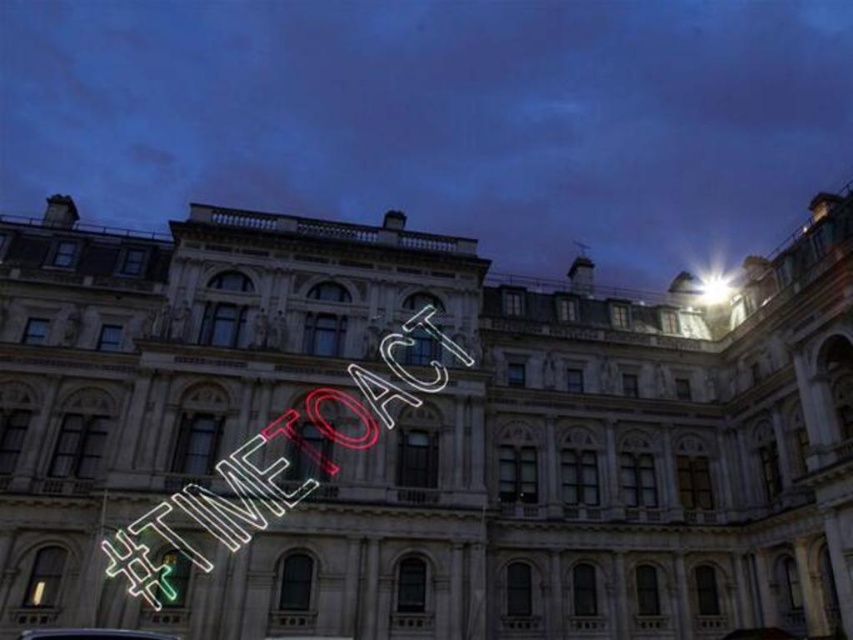
You are a delivery person who needs to park your 2.5 meter wide delivery van between the neon sign at center and the shiny silver car at lower center. Can you fit your van between them without touching either object?

The neon sign at center and the shiny silver car at lower center are 12.45 meters apart. Since the van is only 2.5 meters wide, there is sufficient space between them to park the van without touching either object.

You are standing in front of the grand historic building and want to take a photo of both the neon sign at center and the shiny silver car at lower center. Which object should you focus on first to ensure both are in frame?

You should focus on the neon sign at center first because it is closer to you than the shiny silver car at lower center, ensuring both are in frame by adjusting the camera angle accordingly.

You are standing in front of the historic building and see the neon sign at center and the shiny silver car at lower center. Which object is positioned higher relative to the other?

The neon sign at center is positioned higher than the shiny silver car at lower center because it is located above it.